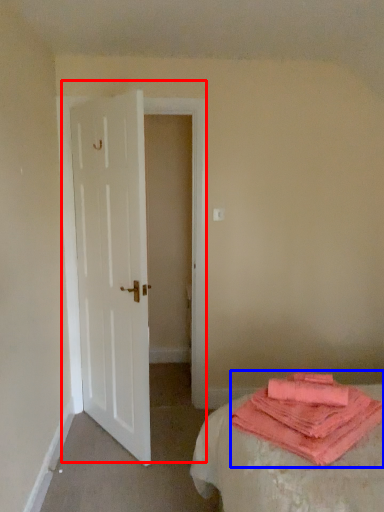
Question: Among these objects, which one is nearest to the camera, door (highlighted by a red box) or cloth (highlighted by a blue box)?

Choices:
 (A) door
 (B) cloth

Answer: (B)